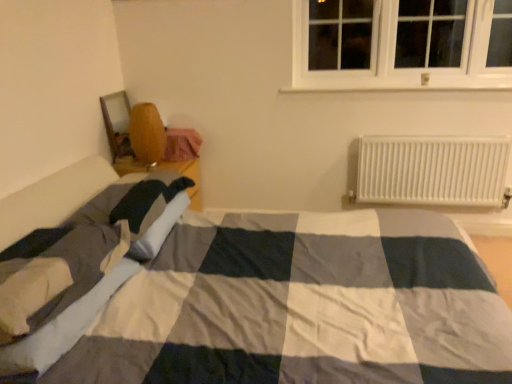
Question: Is wooden chair at left thinner than white plastic radiator at right?

Choices:
 (A) yes
 (B) no

Answer: (B)

Question: Is wooden chair at left positioned before white plastic radiator at right?

Choices:
 (A) yes
 (B) no

Answer: (B)

Question: Is wooden chair at left not inside white plastic radiator at right?

Choices:
 (A) yes
 (B) no

Answer: (A)

Question: Can you confirm if wooden chair at left is smaller than white plastic radiator at right?

Choices:
 (A) yes
 (B) no

Answer: (A)

Question: Does wooden chair at left appear on the left side of white plastic radiator at right?

Choices:
 (A) yes
 (B) no

Answer: (A)

Question: Is wooden chair at left further to the viewer compared to white plastic radiator at right?

Choices:
 (A) no
 (B) yes

Answer: (B)

Question: Is white plastic radiator at right positioned before wooden chair at left?

Choices:
 (A) no
 (B) yes

Answer: (B)

Question: Is the surface of white plastic radiator at right in direct contact with wooden chair at left?

Choices:
 (A) no
 (B) yes

Answer: (A)

Question: Is white plastic radiator at right taller than wooden chair at left?

Choices:
 (A) no
 (B) yes

Answer: (B)

Question: From the image's perspective, would you say white plastic radiator at right is shown under wooden chair at left?

Choices:
 (A) no
 (B) yes

Answer: (B)

Question: Does white plastic radiator at right have a smaller size compared to wooden chair at left?

Choices:
 (A) no
 (B) yes

Answer: (A)

Question: Can you confirm if white plastic radiator at right is positioned to the left of wooden chair at left?

Choices:
 (A) no
 (B) yes

Answer: (A)

Question: Does white cotton blanket at lower left have a larger size compared to wooden chair at left?

Choices:
 (A) no
 (B) yes

Answer: (B)